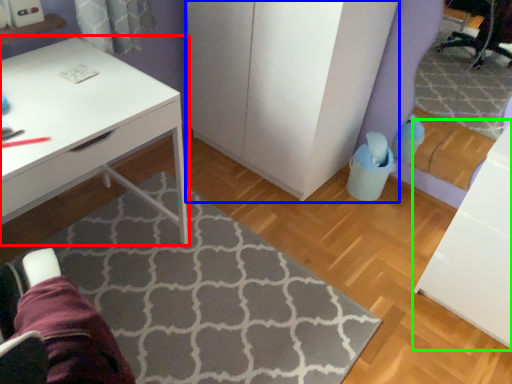
Question: Which object is the farthest from desk (highlighted by a red box)? Choose among these: dresser (highlighted by a blue box) or file cabinet (highlighted by a green box).

Choices:
 (A) dresser
 (B) file cabinet

Answer: (B)